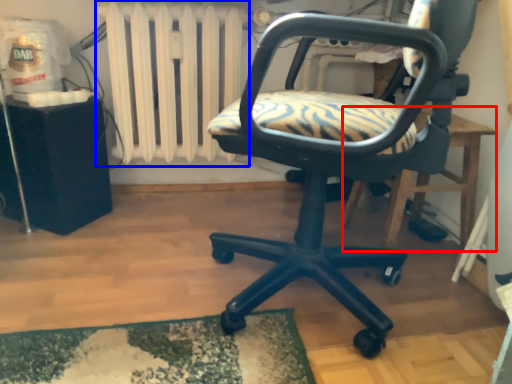
Question: Among these objects, which one is farthest to the camera, table (highlighted by a red box) or radiator (highlighted by a blue box)?

Choices:
 (A) table
 (B) radiator

Answer: (B)